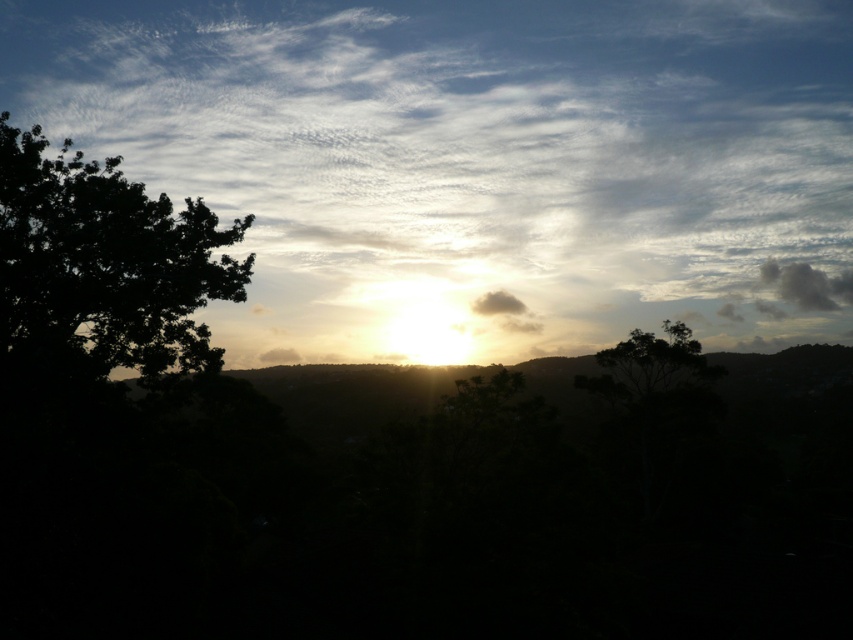
You are observing the sunset scene and notice two trees in the foreground. Which of the two trees, the dark leafy tree at left or the dark green leafy tree at center, appears higher in the image?

The dark leafy tree at left appears higher in the image as it is located above the dark green leafy tree at center.

You are an artist trying to paint the sunset scene. You notice the white fluffy cloud at upper center and the dark green leafy tree at center. Which object is located above the other?

The white fluffy cloud at upper center is positioned over dark green leafy tree at center, so it is above the tree.